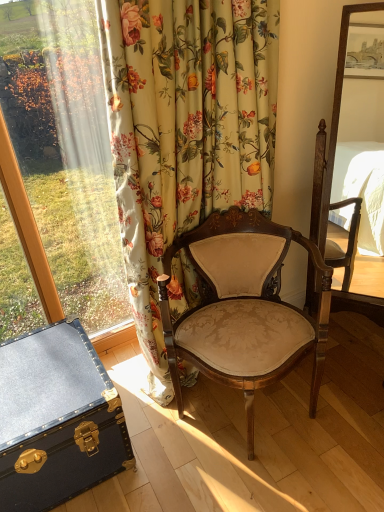
Where is `vacant space in front of matte beige fabric chair at center`? This screenshot has height=512, width=384. vacant space in front of matte beige fabric chair at center is located at coordinates (274, 483).